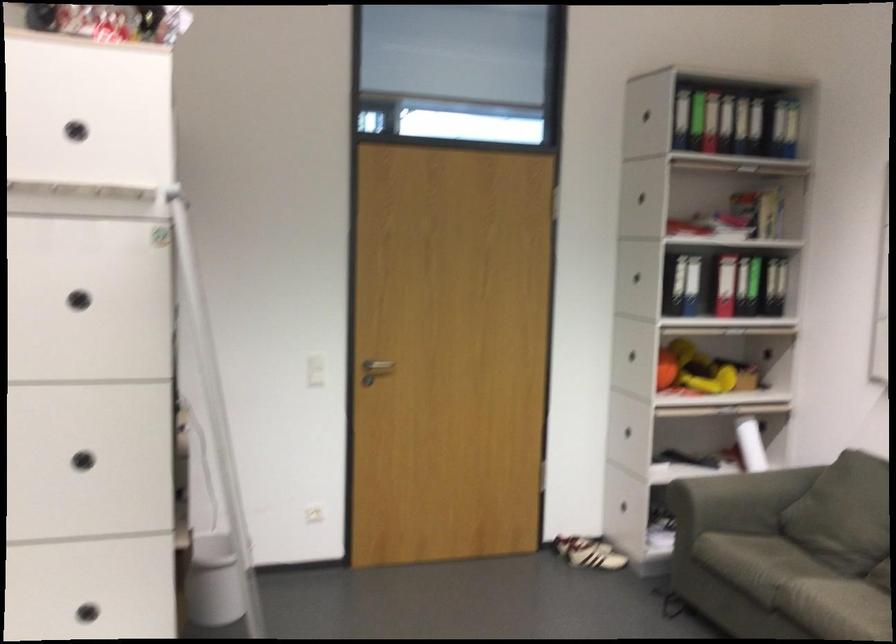
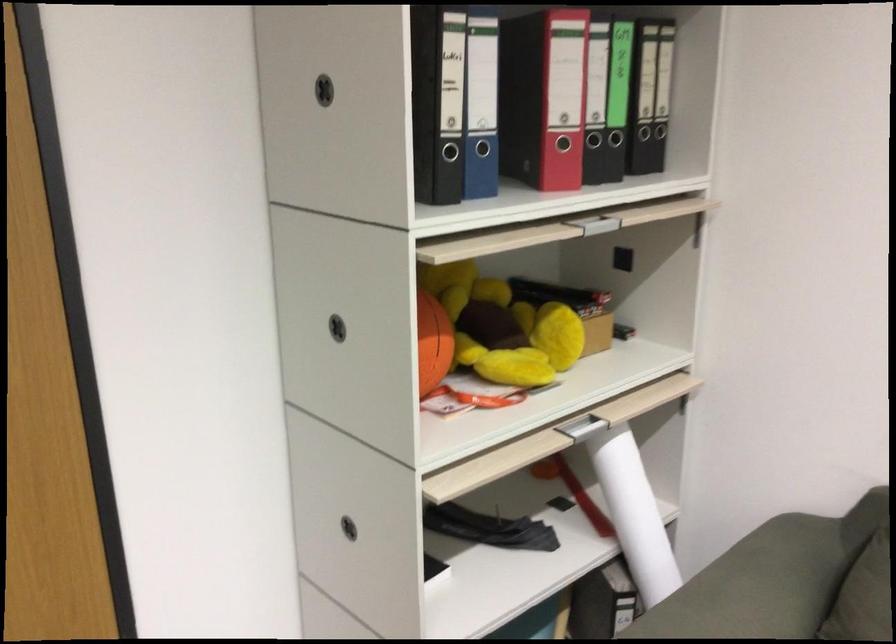
Question: I am providing you with two images of the same scene from different viewpoints. After the viewpoint changes to image2, which objects are now occluded?

Choices:
 (A) drawer handle
 (B) white paper roll
 (C) green binder
 (D) pink phone case

Answer: (C)